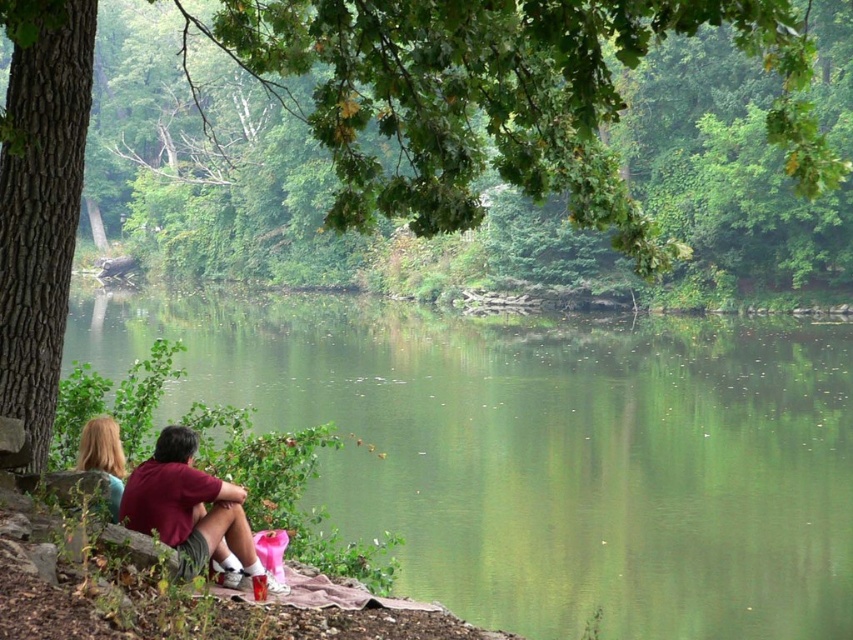
What do you see at coordinates (39, 200) in the screenshot? I see `smooth brown tree trunk at left` at bounding box center [39, 200].

Is point (50, 26) farther from camera compared to point (111, 508)?

No, (50, 26) is in front of (111, 508).

This screenshot has height=640, width=853. Identify the location of smooth brown tree trunk at left. (39, 200).

Locate an element on the screen. The width and height of the screenshot is (853, 640). smooth brown tree trunk at left is located at coordinates (39, 200).

Between green smooth water at lower center and blonde hair at left, which one has more height?

With more height is green smooth water at lower center.

Where is `green smooth water at lower center`? green smooth water at lower center is located at coordinates click(544, 452).

Identify the location of green smooth water at lower center. The image size is (853, 640). (544, 452).

Who is taller, green smooth water at lower center or smooth brown tree trunk at left?

green smooth water at lower center is taller.

Is green smooth water at lower center behind smooth brown tree trunk at left?

Yes, green smooth water at lower center is behind smooth brown tree trunk at left.

This screenshot has height=640, width=853. Describe the element at coordinates (544, 452) in the screenshot. I see `green smooth water at lower center` at that location.

In order to click on green smooth water at lower center in this screenshot , I will do `click(544, 452)`.